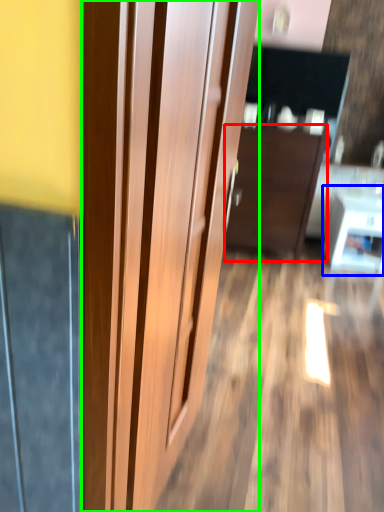
Question: Based on their relative distances, which object is nearer to furniture (highlighted by a red box)? Choose from table (highlighted by a blue box) and door (highlighted by a green box).

Choices:
 (A) table
 (B) door

Answer: (A)